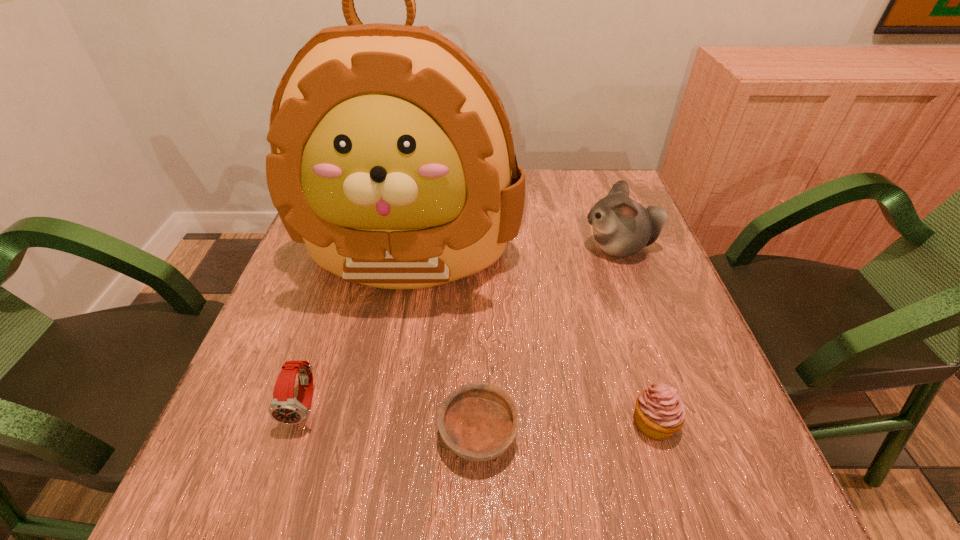
Find the location of a particular element. free spot that satisfies the following two spatial constraints: 1. on the face of the watch; 2. on the right side of the cupcake is located at coordinates (300, 423).

At what (x,y) coordinates should I click in order to perform the action: click on free region that satisfies the following two spatial constraints: 1. on the back side of the shortest object; 2. on the right side of the cupcake. Please return your answer as a coordinate pair (x, y). This screenshot has height=540, width=960. Looking at the image, I should click on (478, 423).

The height and width of the screenshot is (540, 960). In order to click on free region that satisfies the following two spatial constraints: 1. on the back side of the shortest object; 2. on the right side of the cupcake in this screenshot , I will do `click(478, 423)`.

The image size is (960, 540). What are the coordinates of `vacant space that satisfies the following two spatial constraints: 1. on the front-facing side of the tallest object; 2. on the right side of the cupcake` in the screenshot? It's located at (378, 423).